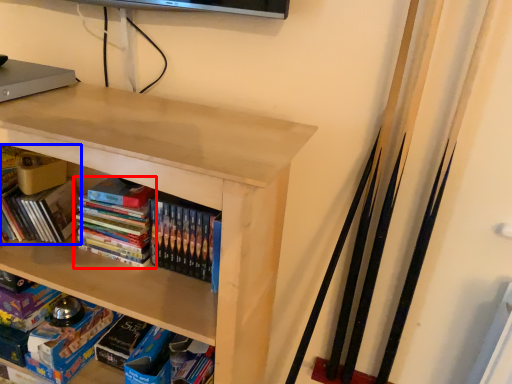
Question: Which object is further to the camera taking this photo, book (highlighted by a red box) or book (highlighted by a blue box)?

Choices:
 (A) book
 (B) book

Answer: (B)